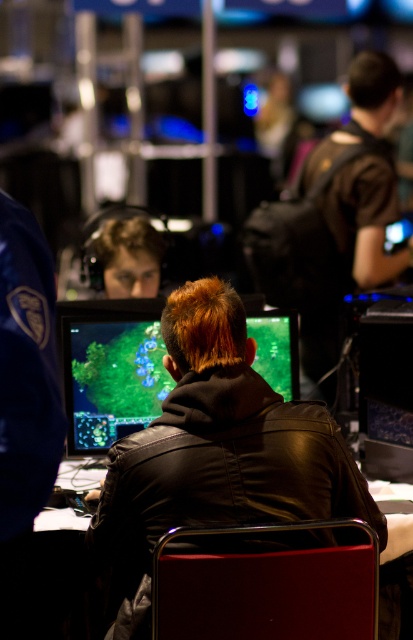
You are a photographer at the event and want to take a photo of the black leather jacket at center without the metallic red chair at center appearing in the background. Is the chair currently positioned behind the jacket?

The metallic red chair at center is behind the black leather jacket at center, so yes, the chair is positioned behind the jacket and would appear in the background of the photo.

You are a photographer at the gaming event. You need to capture a photo of the black leather jacket at center and the matte black monitor at center. Based on their sizes, which one will appear larger in the photo?

The black leather jacket at center is bigger than the matte black monitor at center, so it will appear larger in the photo.

You are at the gaming event and want to sit down. Where is the metallic red chair at center located in the image?

The metallic red chair at center is located at point [266,588] in the image.